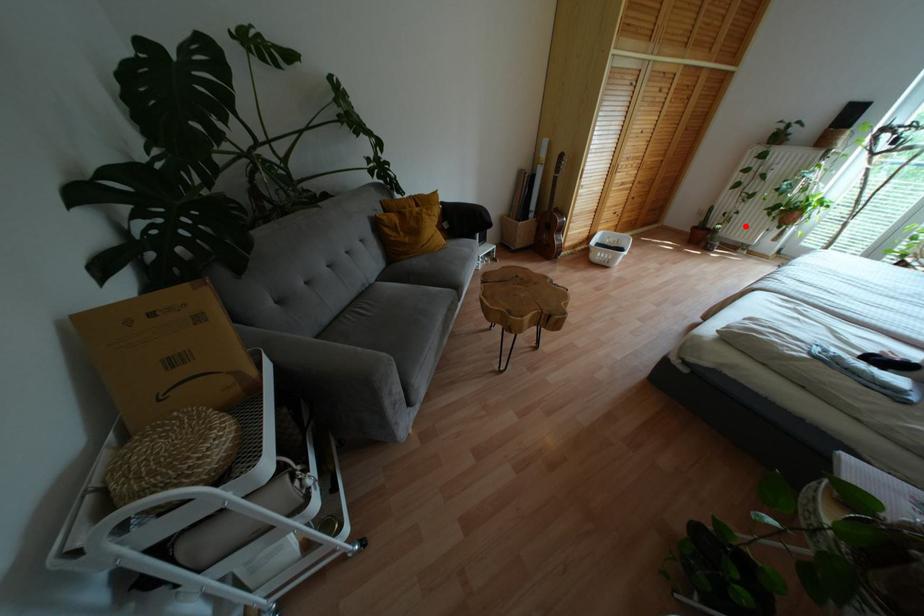
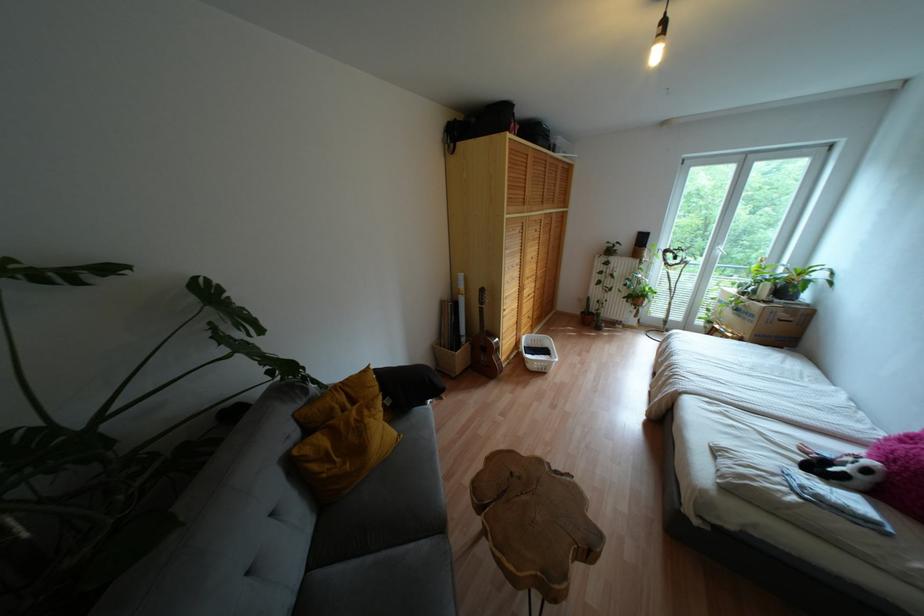
Question: I am providing you with two images of the same scene from different viewpoints. Given a red point in image1, look at the same physical point in image2. Is it:

Choices:
 (A) Closer to the viewpoint
 (B) Farther from the viewpoint

Answer: (A)